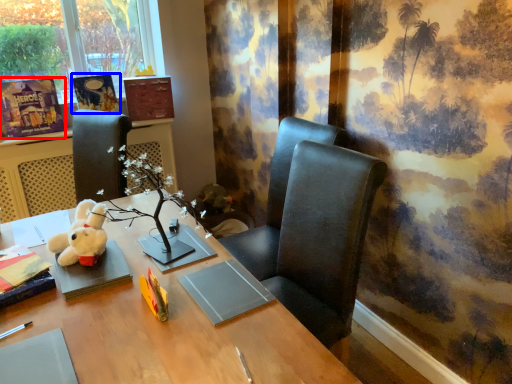
Question: Which object appears closest to the camera in this image, book (highlighted by a red box) or book (highlighted by a blue box)?

Choices:
 (A) book
 (B) book

Answer: (A)